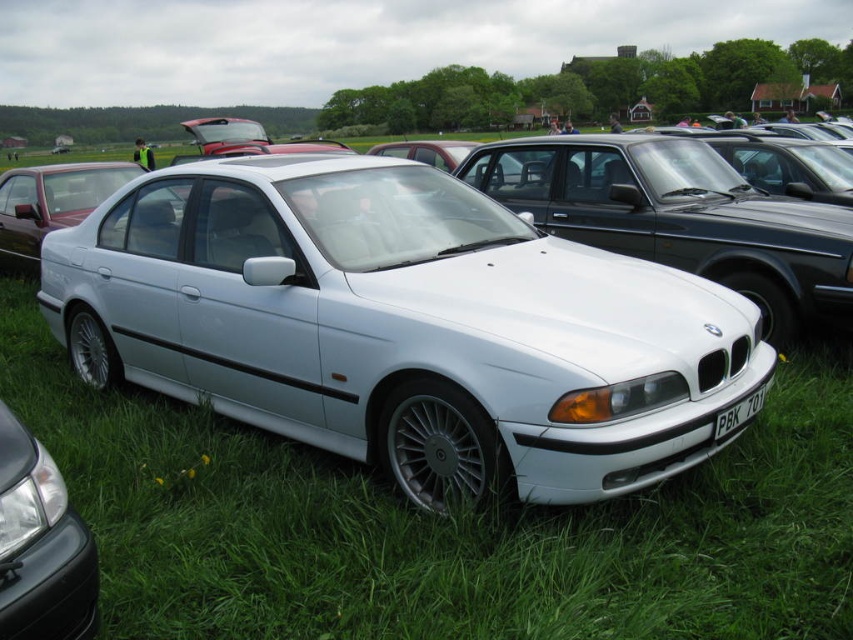
Question: Can you confirm if satin black headlight at lower left is positioned above white plastic license plate at front?

Choices:
 (A) yes
 (B) no

Answer: (B)

Question: Which object is closer to the camera taking this photo?

Choices:
 (A) white plastic license plate at front
 (B) satin black headlight at lower left

Answer: (B)

Question: Can you confirm if white metallic sedan at center is positioned to the right of satin black headlight at lower left?

Choices:
 (A) no
 (B) yes

Answer: (B)

Question: Can you confirm if satin black headlight at lower left is wider than white plastic license plate at front?

Choices:
 (A) yes
 (B) no

Answer: (B)

Question: Which point is farther from the camera taking this photo?

Choices:
 (A) (28, 435)
 (B) (752, 401)

Answer: (B)

Question: Which point is closer to the camera taking this photo?

Choices:
 (A) (724, 420)
 (B) (74, 634)
 (C) (367, 292)

Answer: (B)